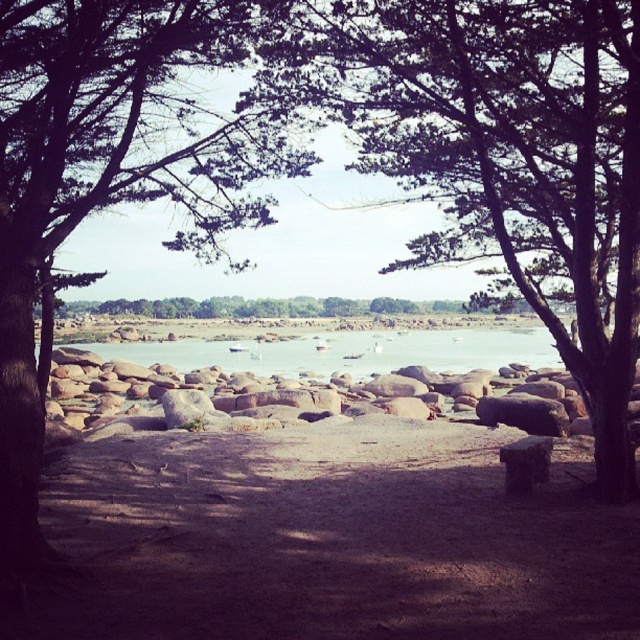
You are standing on the sandy area with scattered rocks in the foreground of the coastal scene. You want to reach the brown sandy dirt at center marked by point (330, 540). Which direction should you walk from your current position?

Walk straight ahead towards the center of the scene to reach the brown sandy dirt at center marked by point (330, 540).

You are standing at the edge of the coastal scene and want to walk towards the water. Which object, the brown sandy dirt at center or the clear water at center, will you step on first?

The brown sandy dirt at center is closer to the viewer than the clear water at center, so you will step on the brown sandy dirt at center first.